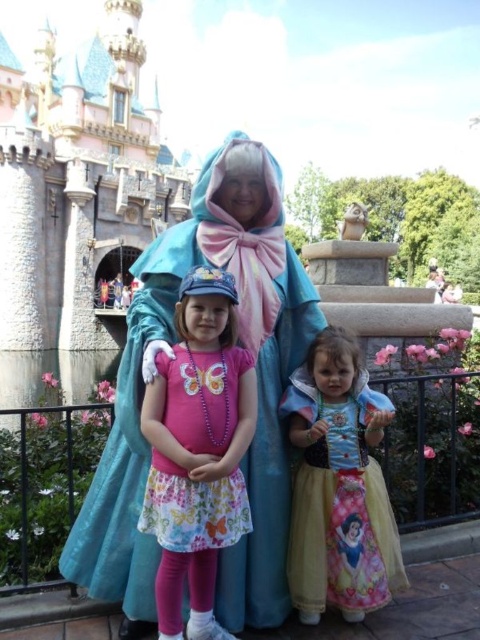
Does turquoise satin cape at center have a greater width compared to pink fabric dress at center?

Indeed, turquoise satin cape at center has a greater width compared to pink fabric dress at center.

Does point (134, 525) lie behind point (187, 342)?

No, (134, 525) is closer to viewer.

Where is `turquoise satin cape at center`? The image size is (480, 640). turquoise satin cape at center is located at coordinates (257, 394).

Describe the element at coordinates (76, 202) in the screenshot. I see `stone castle at center` at that location.

Does stone castle at center come behind turquoise satin cape at center?

That is True.

Is point (26, 304) positioned before point (192, 250)?

No, it is not.

This screenshot has height=640, width=480. Find the location of `stone castle at center`. stone castle at center is located at coordinates [76, 202].

Which is below, stone castle at center or yellow satin dress at center?

yellow satin dress at center is lower down.

Does stone castle at center have a lesser width compared to yellow satin dress at center?

Incorrect, stone castle at center's width is not less than yellow satin dress at center's.

Image resolution: width=480 pixels, height=640 pixels. In order to click on stone castle at center in this screenshot , I will do `click(76, 202)`.